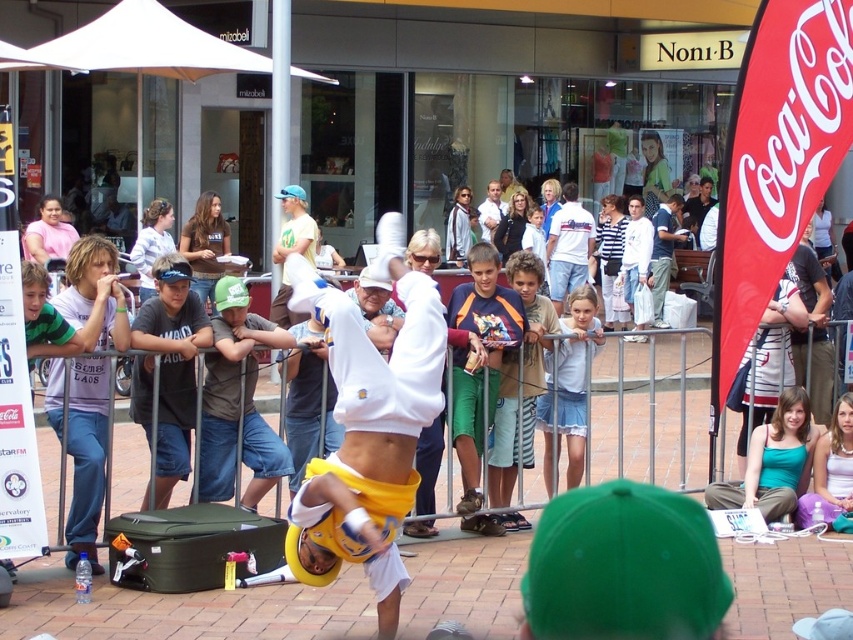
You are standing at the center of the street and see two points marked in the image. Which point, point (427,406) or point (480,211), is closer to you?

Point (427,406) is closer to the viewer than point (480,211).

You are a photographer trying to capture both the white matte sweatshirt at center and the white cotton shirt at center in a single frame. Since both are at the center, how can you ensure both are visible without overlapping?

Since the white matte sweatshirt at center is smaller than the white cotton shirt at center, you can position the smaller sweatshirt slightly to one side while keeping the shirt centered. This way, both items remain visible without overlapping.

You are standing in the street and see the white matte sweatshirt at center. If you want to approach it, how many steps would you need to take if each step covers approximately 3 feet?

A: The white matte sweatshirt at center is 19.90 feet away from the viewer. Dividing 19.90 by 3 gives approximately 6.63 steps. Since you can take partial steps, you would need around 7 steps to reach it.